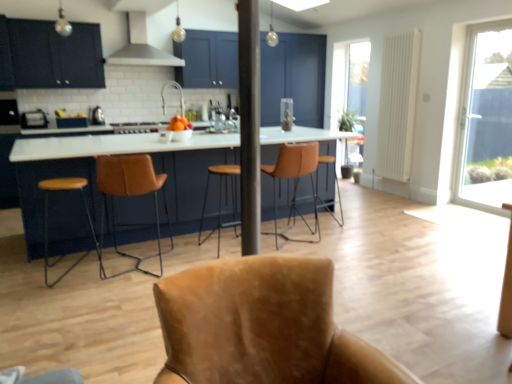
Question: Is satin silver toaster at left, which is the first appliance in right-to-left order, taller or shorter than brown leather bar stool at center, acting as the 1th bar stool starting from the front?

Choices:
 (A) tall
 (B) short

Answer: (B)

Question: In terms of size, does satin silver toaster at left, which ranks as the 3th appliance in front-to-back order, appear bigger or smaller than brown leather bar stool at center, which appears as the 1th bar stool when viewed from the left?

Choices:
 (A) big
 (B) small

Answer: (B)

Question: Estimate the real-world distances between objects in this image. Which object is closer to the metallic silver toaster at left, positioned as the third appliance in right-to-left order?

Choices:
 (A) transparent glass door at right
 (B) brown leather stool at left, placed as the second chair when sorted from back to front
 (C) suede tan armchair at center, the 1th chair positioned from the front
 (D) matte black cabinets at upper left
 (E) satin silver toaster at left, which is the first appliance in right-to-left order

Answer: (D)

Question: Considering the real-world distances, which object is closest to the matte black cabinets at upper left?

Choices:
 (A) metallic silver toaster at left, which is the first appliance from front to back
 (B) shiny orange fruit at center
 (C) satin silver metal at upper center
 (D) suede tan armchair at center, the 1th chair positioned from the front
 (E) white glossy stove at center

Answer: (A)